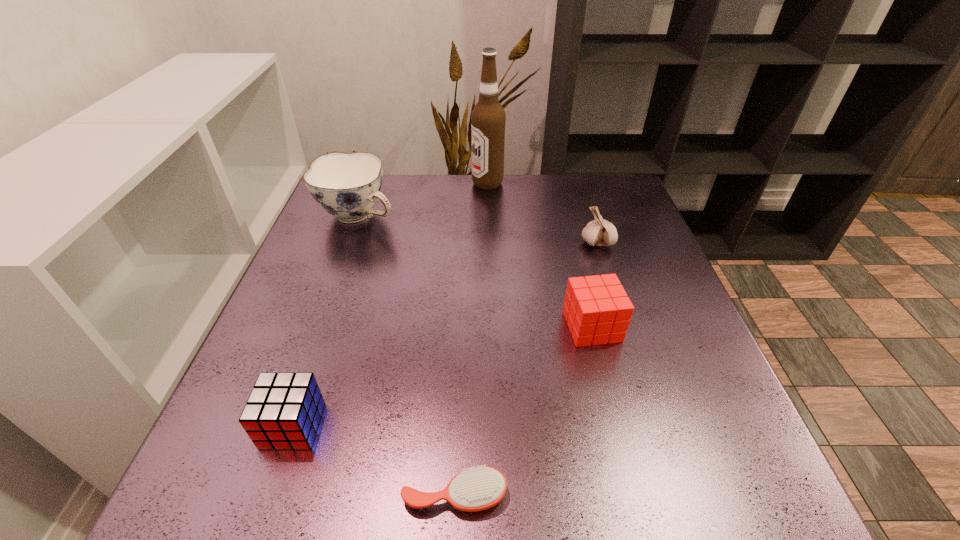
Locate which object ranks second in proximity to the second nearest object. Please provide its 2D coordinates. Your answer should be formatted as a tuple, i.e. [(x, y)], where the tuple contains the x and y coordinates of a point satisfying the conditions above.

[(597, 310)]

Locate an element on the screen. the fourth closest object to the fifth farthest object is located at coordinates (599, 232).

Find the location of a particular element. This screenshot has width=960, height=540. free location that satisfies the following two spatial constraints: 1. on the label of the garlic; 2. on the left side of the farthest object is located at coordinates (489, 242).

The image size is (960, 540). Find the location of `free space that satisfies the following two spatial constraints: 1. on the back side of the left cube; 2. on the right side of the garlic`. free space that satisfies the following two spatial constraints: 1. on the back side of the left cube; 2. on the right side of the garlic is located at coordinates (355, 242).

Find the location of a particular element. vacant area in the image that satisfies the following two spatial constraints: 1. on the label of the farthest object; 2. on the front side of the fifth shortest object is located at coordinates (489, 215).

At what (x,y) coordinates should I click in order to perform the action: click on blank space that satisfies the following two spatial constraints: 1. on the front side of the chinaware; 2. on the left side of the left cube. Please return your answer as a coordinate pair (x, y). The image size is (960, 540). Looking at the image, I should click on (283, 425).